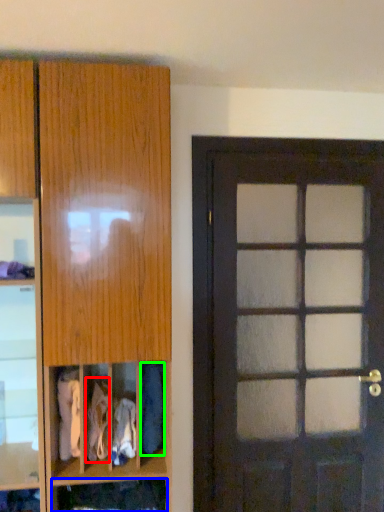
Question: Which object is positioned closest to clothing (highlighted by a red box)? Select from cabinet (highlighted by a blue box) and clothing (highlighted by a green box).

Choices:
 (A) cabinet
 (B) clothing

Answer: (A)